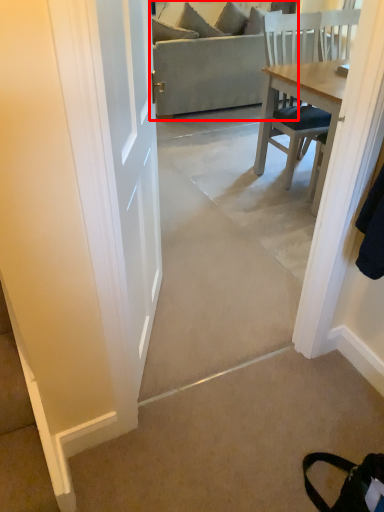
Question: From the image, what is the correct spatial relationship of studio couch (annotated by the red box) in relation to concrete?

Choices:
 (A) right
 (B) left

Answer: (A)